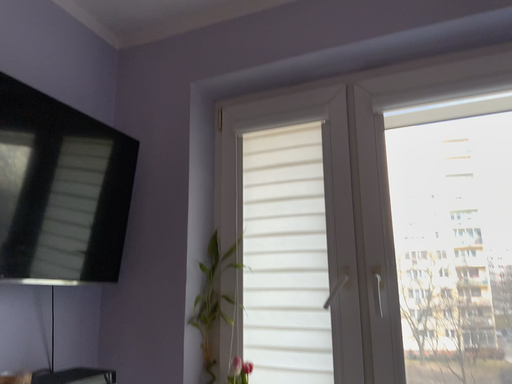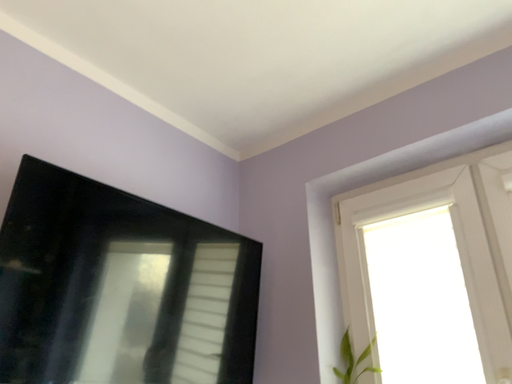
Question: How did the camera likely rotate when shooting the video?

Choices:
 (A) rotated downward
 (B) rotated upward

Answer: (B)